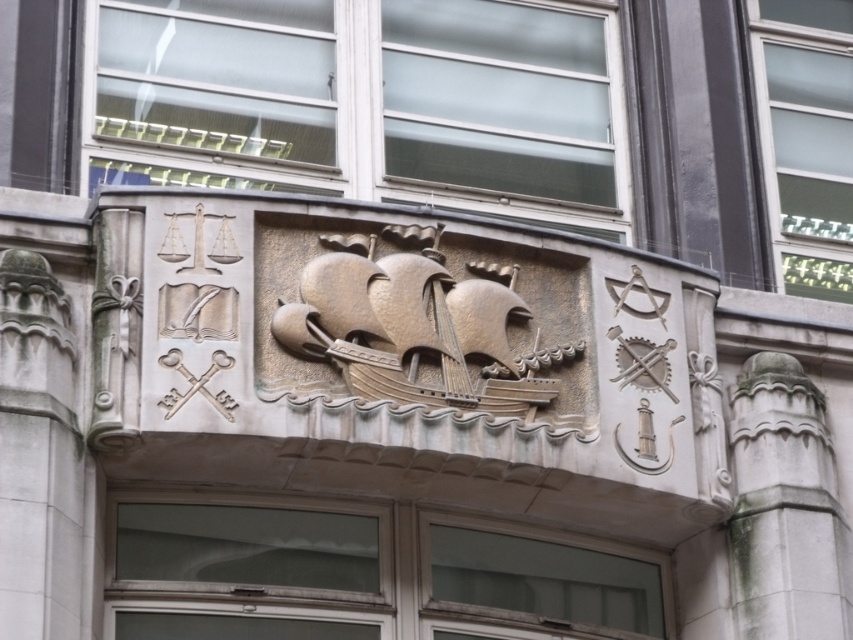
Which is in front, point (525, 593) or point (782, 374)?

Point (525, 593)

Who is shorter, smooth glass door at center or white stone column at center?

Standing shorter between the two is white stone column at center.

The image size is (853, 640). In order to click on smooth glass door at center in this screenshot , I will do `click(364, 572)`.